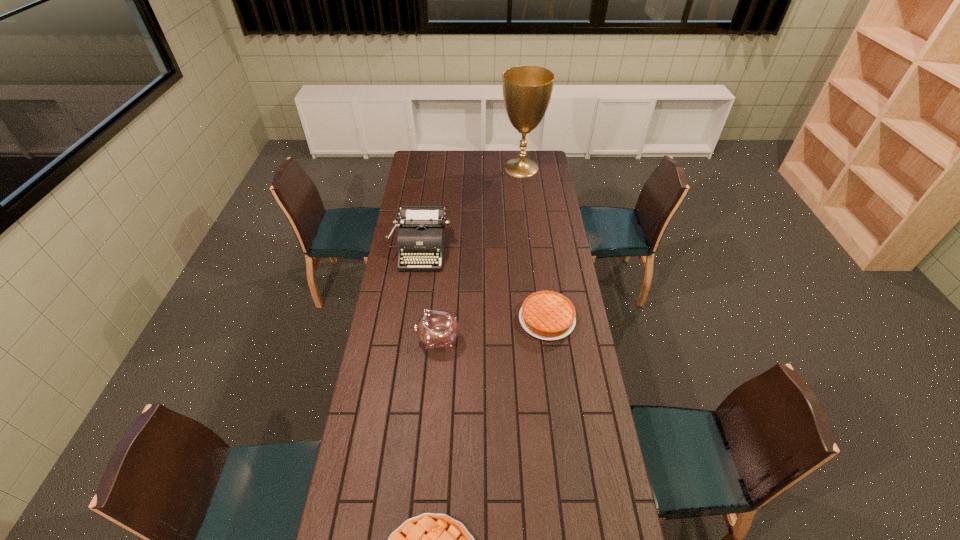
You are a GUI agent. You are given a task and a screenshot of the screen. Output one action in this format:
    pyautogui.click(x=<x>, y=<y>)
    Task: Click on the vacant space that's between the farther pie and the tallest object
    Image resolution: width=960 pixels, height=540 pixels.
    Given the screenshot: What is the action you would take?
    pyautogui.click(x=534, y=244)

Where is `vacant space in between the farther pie and the fourth nearest object`? The height and width of the screenshot is (540, 960). vacant space in between the farther pie and the fourth nearest object is located at coordinates (484, 284).

Locate an element on the screen. This screenshot has height=540, width=960. free space between the farther pie and the trophy cup is located at coordinates (534, 244).

Locate an element on the screen. object that is the third closest to the trophy cup is located at coordinates (436, 328).

Find the location of a particular element. the third closest object to the trophy cup is located at coordinates (436, 328).

In order to click on free spot that satisfies the following two spatial constraints: 1. on the front-facing side of the right pie; 2. on the left side of the typewriter in this screenshot , I will do `click(412, 319)`.